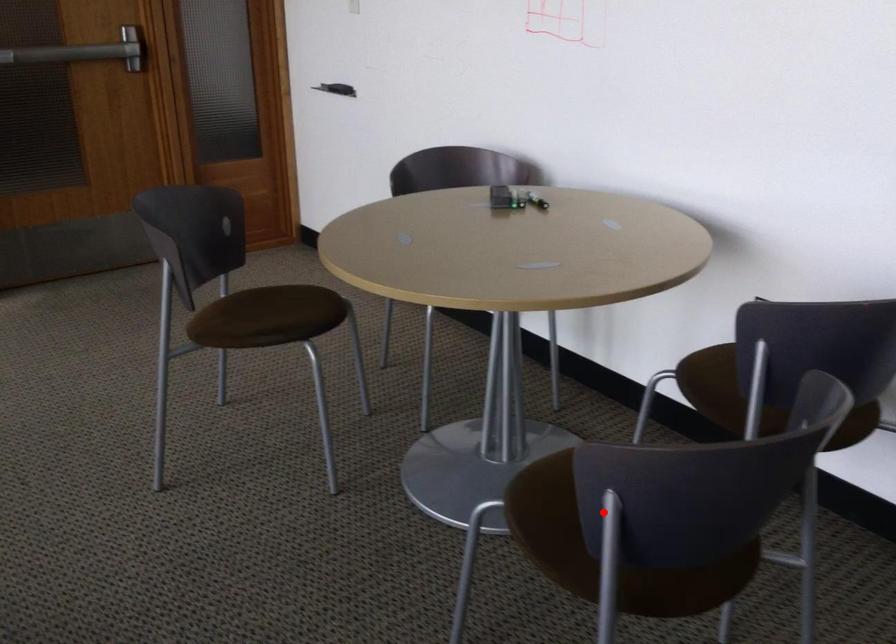
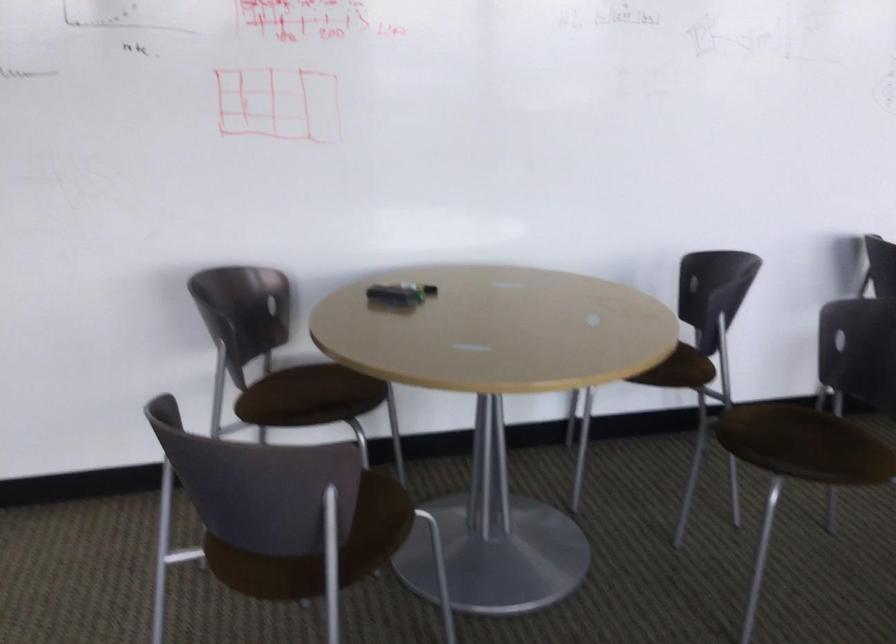
In the second image, find the point that corresponds to the highlighted location in the first image.

(798, 437)